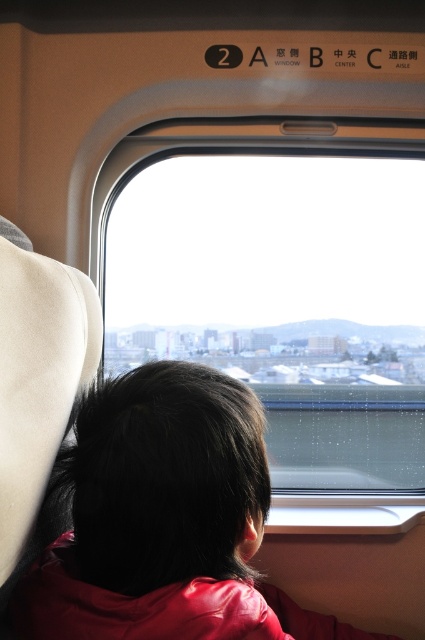
You are sitting in the train car and want to put your red leather jacket at center on a seat that is 1.5 meters away from the transparent glass window at center. Is there enough space between them?

The transparent glass window at center and the red leather jacket at center are 1.43 meters apart, so there is enough space since 1.43 meters is less than 1.5 meters.

You are sitting in the train car and want to see the view outside. Which object, the transparent glass window at center or the red leather jacket at center, is closer to your right side?

The transparent glass window at center is positioned on the right side of the red leather jacket at center, so it is closer to your right side.